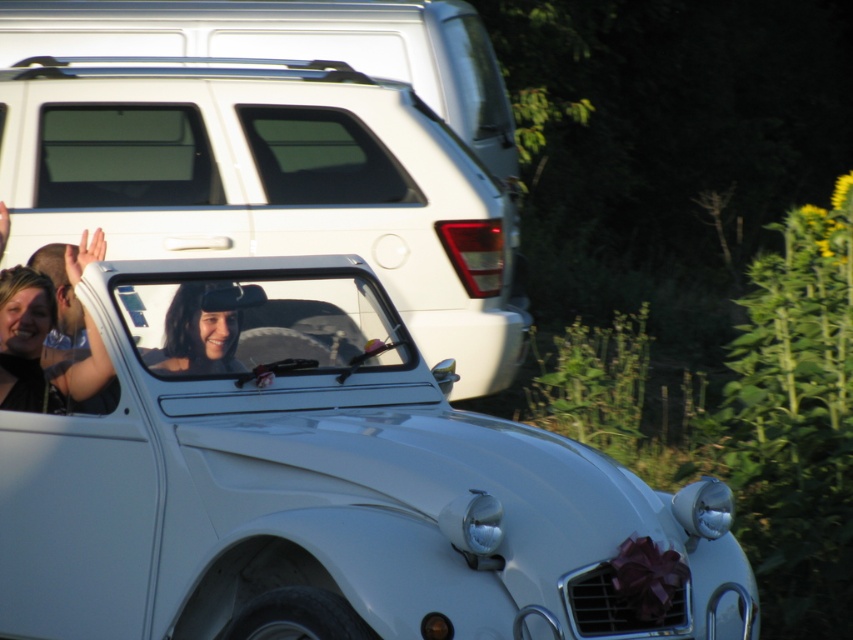
Looking at this image, you are standing in the middle of the scene and want to move towards the matte black hat at center. Which direction should you walk to avoid the white matte suv at upper left?

To reach the matte black hat at center while avoiding the white matte suv at upper left, you should walk to the right, as the white matte suv is positioned to the left of the matte black hat.

You are a photographer standing 1 meter away from the white glossy car at center and the matte black hat at center. Can you fit both objects into a single frame without moving your position? Explain your reasoning.

The distance between the white glossy car at center and the matte black hat at center is 45.03 centimeters. Since you are standing 1 meter away from both objects, the total distance between them is less than the 1 meter, so they can both fit into a single frame without moving your position.

You are standing at the origin point of the image coordinate system. The vintage white car is at the center. Where exactly is the white glossy car at center located in terms of coordinates?

The white glossy car at center is located at coordinates point (329, 490).